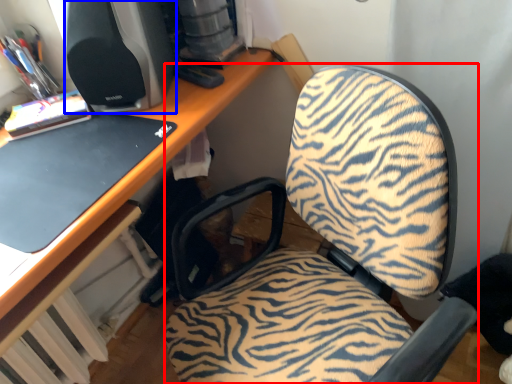
Question: Which of the following is the farthest to the observer, furniture (highlighted by a red box) or desktop computer (highlighted by a blue box)?

Choices:
 (A) furniture
 (B) desktop computer

Answer: (B)